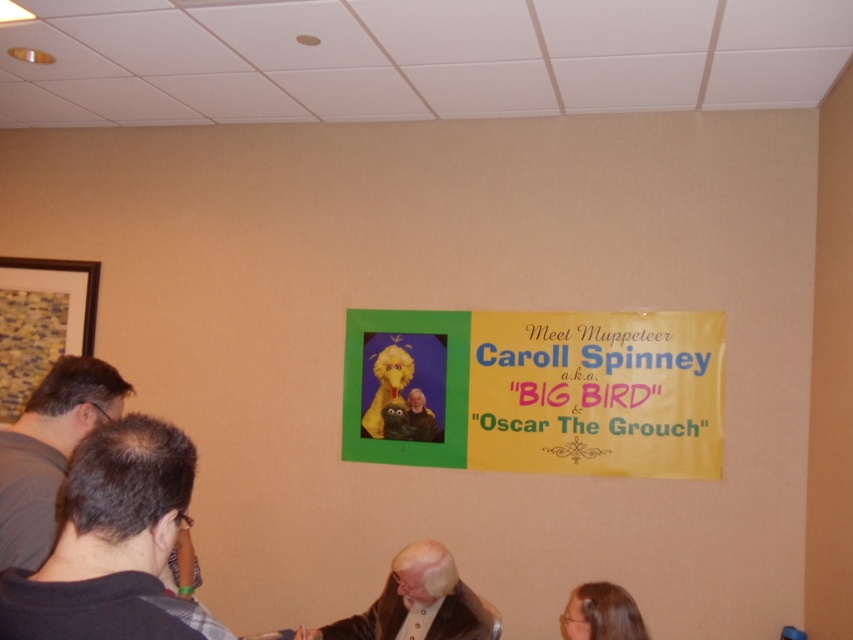
Which is above, dark gray hair at left or white textured suit at lower center?

dark gray hair at left is higher up.

Does dark gray hair at left have a greater width compared to white textured suit at lower center?

Incorrect, dark gray hair at left's width does not surpass white textured suit at lower center's.

In order to click on dark gray hair at left in this screenshot , I will do `click(49, 451)`.

Locate an element on the screen. The image size is (853, 640). dark gray hair at left is located at coordinates (49, 451).

Does yellow paper at upper center appear over dark gray hair at left?

Actually, yellow paper at upper center is below dark gray hair at left.

You are a GUI agent. You are given a task and a screenshot of the screen. Output one action in this format:
    pyautogui.click(x=<x>, y=<y>)
    Task: Click on the yellow paper at upper center
    
    Given the screenshot: What is the action you would take?
    pyautogui.click(x=537, y=390)

This screenshot has height=640, width=853. I want to click on yellow paper at upper center, so click(x=537, y=390).

Does yellow paper at upper center appear under white textured suit at lower center?

Incorrect, yellow paper at upper center is not positioned below white textured suit at lower center.

Which is more to the right, yellow paper at upper center or white textured suit at lower center?

yellow paper at upper center

You are a GUI agent. You are given a task and a screenshot of the screen. Output one action in this format:
    pyautogui.click(x=<x>, y=<y>)
    Task: Click on the yellow paper at upper center
    The width and height of the screenshot is (853, 640).
    Given the screenshot: What is the action you would take?
    pyautogui.click(x=537, y=390)

The height and width of the screenshot is (640, 853). In order to click on yellow paper at upper center in this screenshot , I will do `click(537, 390)`.